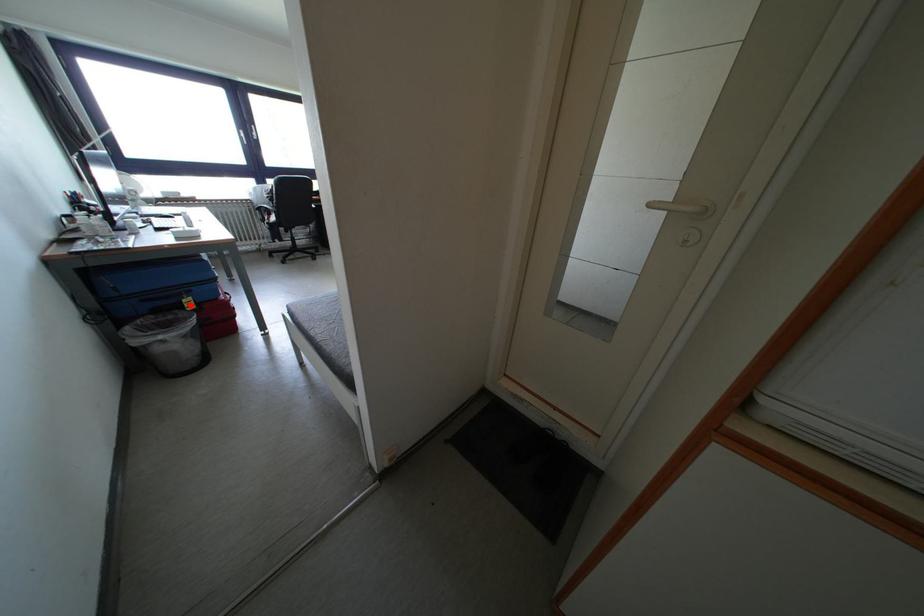
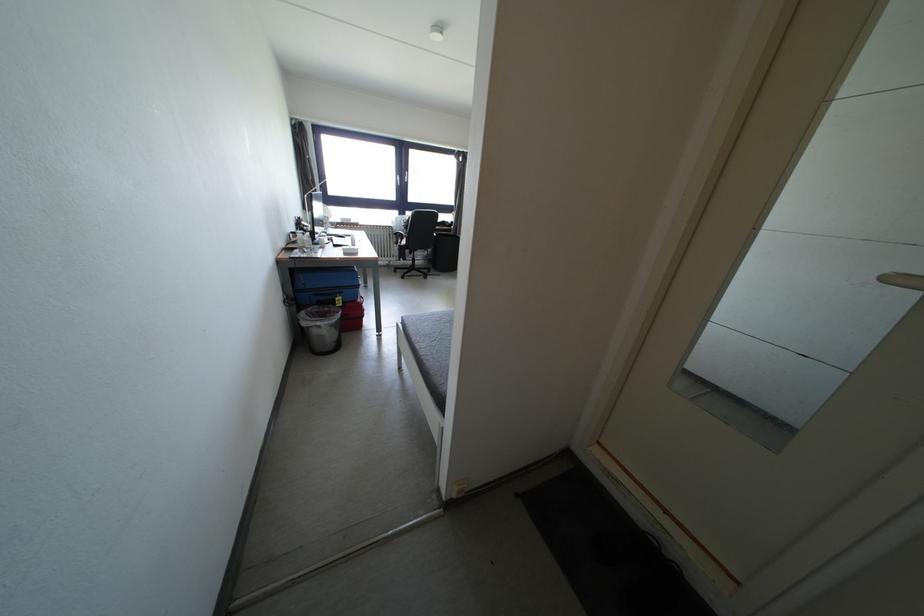
Question: I am providing you with two images of the same scene from different viewpoints. Given a red point in image1, look at the same physical point in image2. Is it:

Choices:
 (A) Closer to the viewpoint
 (B) Farther from the viewpoint

Answer: (A)